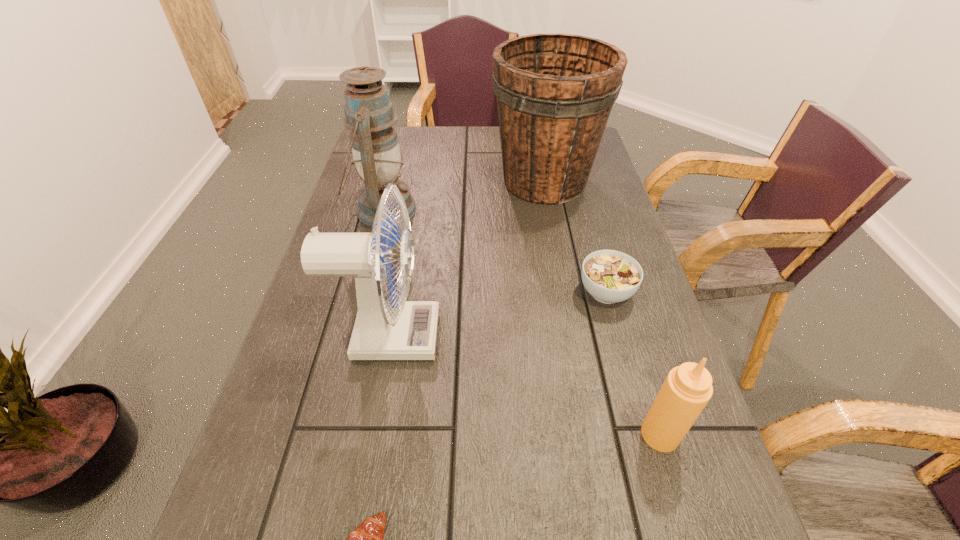
At what (x,y) coordinates should I click in order to perform the action: click on free space located 0.240m on the back of the soup bowl. Please return your answer as a coordinate pair (x, y). Looking at the image, I should click on (584, 211).

At what (x,y) coordinates should I click in order to perform the action: click on object located at the far edge. Please return your answer as a coordinate pair (x, y). This screenshot has height=540, width=960. Looking at the image, I should click on (555, 92).

Find the location of a particular element. oil lamp that is at the left edge is located at coordinates (369, 113).

Image resolution: width=960 pixels, height=540 pixels. In order to click on fan that is at the left edge in this screenshot , I will do `click(384, 330)`.

At what (x,y) coordinates should I click in order to perform the action: click on bucket that is positioned at the right edge. Please return your answer as a coordinate pair (x, y). Image resolution: width=960 pixels, height=540 pixels. Looking at the image, I should click on (555, 92).

At what (x,y) coordinates should I click in order to perform the action: click on condiment positioned at the right edge. Please return your answer as a coordinate pair (x, y). The height and width of the screenshot is (540, 960). Looking at the image, I should click on (687, 389).

I want to click on soup bowl that is at the right edge, so click(x=610, y=276).

What are the coordinates of `object that is at the far right corner` in the screenshot? It's located at (555, 92).

At what (x,y) coordinates should I click in order to perform the action: click on vacant space at the far edge of the desktop. Please return your answer as a coordinate pair (x, y). The image size is (960, 540). Looking at the image, I should click on 415,161.

Where is `blank space at the left edge of the desktop`? blank space at the left edge of the desktop is located at coordinates (286, 532).